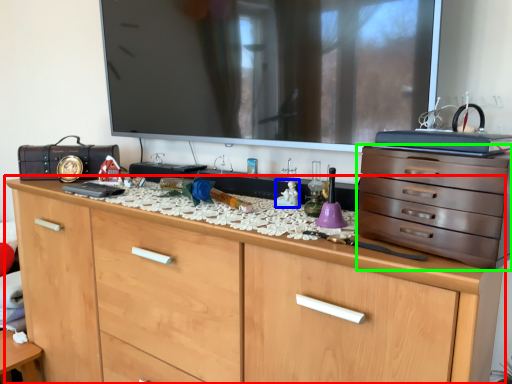
Question: Based on their relative distances, which object is farther from chest of drawers (highlighted by a red box)? Choose from toy (highlighted by a blue box) and chest of drawers (highlighted by a green box).

Choices:
 (A) toy
 (B) chest of drawers

Answer: (A)